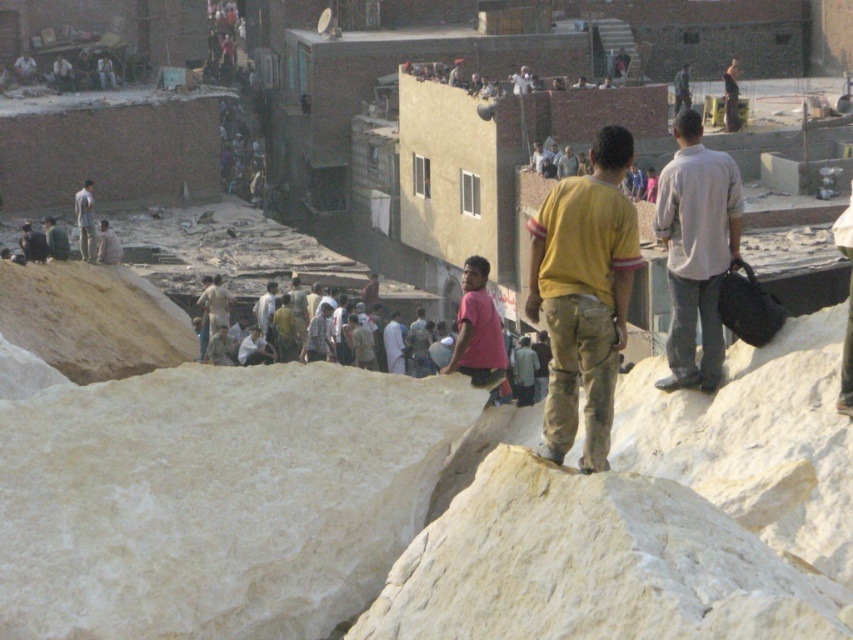
Between point (700, 282) and point (480, 336), which one is positioned in front?

Point (700, 282) is in front.

Can you confirm if light gray cotton shirt at right is positioned to the left of pink fabric shirt at center?

Incorrect, light gray cotton shirt at right is not on the left side of pink fabric shirt at center.

Locate an element on the screen. The width and height of the screenshot is (853, 640). light gray cotton shirt at right is located at coordinates (695, 250).

Which of these two, yellow cotton shirt at center or light gray cotton shirt at right, stands shorter?

light gray cotton shirt at right

From the picture: Can you confirm if yellow cotton shirt at center is positioned above light gray cotton shirt at right?

Yes, yellow cotton shirt at center is above light gray cotton shirt at right.

Who is more forward, (625, 310) or (737, 257)?

Point (625, 310) is more forward.

Where is `yellow cotton shirt at center`? yellow cotton shirt at center is located at coordinates (584, 294).

Does yellow cotton shirt at center come behind light brown leather jacket at upper left?

No, it is in front of light brown leather jacket at upper left.

From the picture: Which is above, yellow cotton shirt at center or light brown leather jacket at upper left?

light brown leather jacket at upper left is above.

Find the location of a particular element. Image resolution: width=853 pixels, height=640 pixels. yellow cotton shirt at center is located at coordinates (584, 294).

The image size is (853, 640). In order to click on yellow cotton shirt at center in this screenshot , I will do `click(584, 294)`.